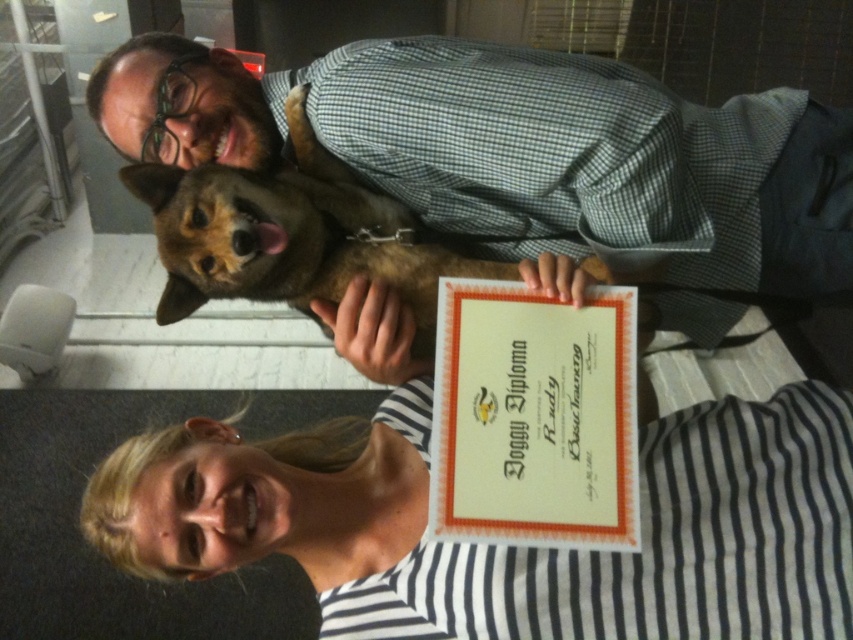
You are a guest at a party and see the orange paper doggy diploma at center and the brown furry dog at upper center. Which object is closer to you?

The orange paper doggy diploma at center is closer to you because it is in front of the brown furry dog at upper center.

Looking at the scene with the two adults and the dog, where is the orange paper doggy diploma at center in relation to the brown furry dog at upper center?

The orange paper doggy diploma at center is to the right of the brown furry dog at upper center.

What is located at the point with coordinates [534,417]?

The point with coordinates [534,417] is on the orange paper doggy diploma at center.